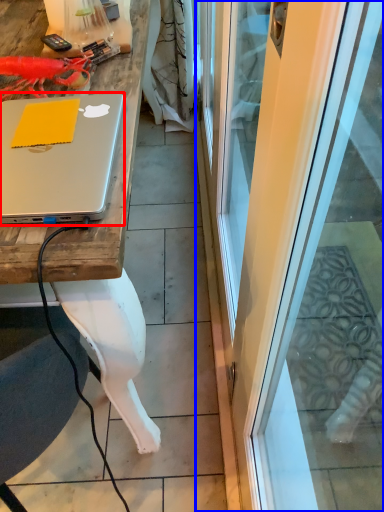
Question: Which point is closer to the camera, laptop (highlighted by a red box) or screen door (highlighted by a blue box)?

Choices:
 (A) laptop
 (B) screen door

Answer: (B)